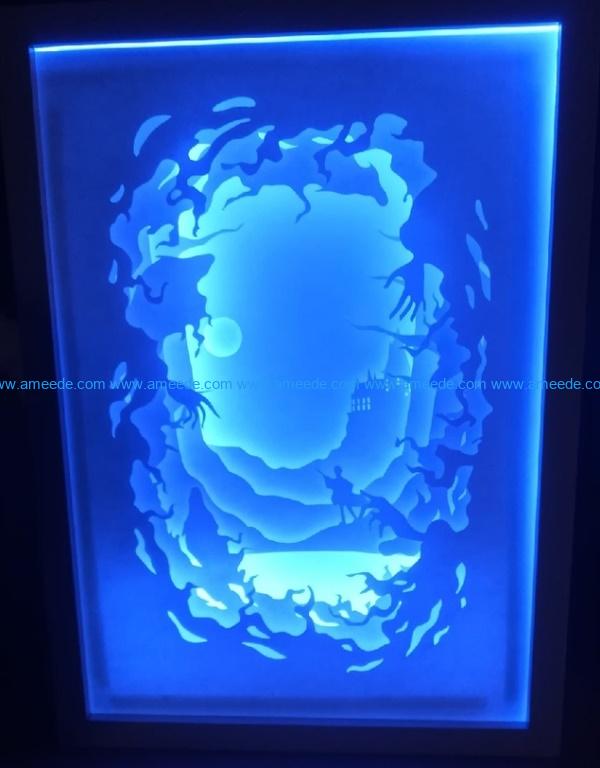
This screenshot has height=768, width=600. Find the location of `art`. art is located at coordinates (444, 664).